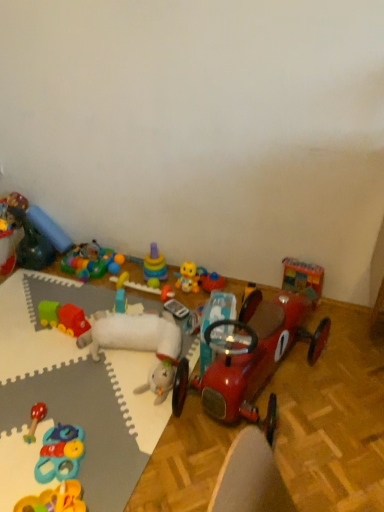
Locate an element on the screen. The height and width of the screenshot is (512, 384). free space in front of rubber duck at upper left, the 11th toy from the right is located at coordinates (37, 282).